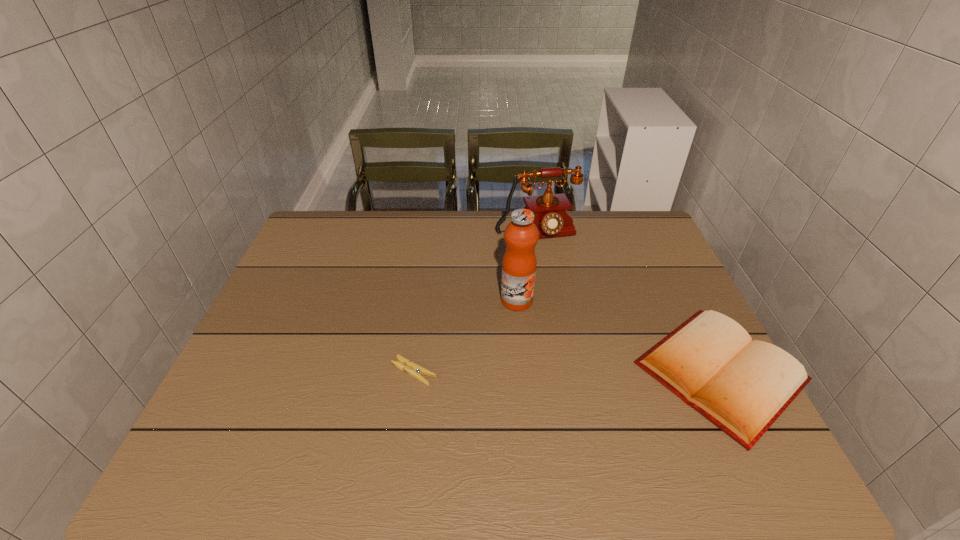
Where is `free space between the shortest object and the second farthest object`? free space between the shortest object and the second farthest object is located at coordinates (466, 336).

Identify the location of free spot between the third tallest object and the second farthest object. The height and width of the screenshot is (540, 960). (618, 336).

At what (x,y) coordinates should I click in order to perform the action: click on free space between the clothespin and the fruit juice. Please return your answer as a coordinate pair (x, y). This screenshot has width=960, height=540. Looking at the image, I should click on (466, 336).

At what (x,y) coordinates should I click in order to perform the action: click on empty space that is in between the clothespin and the fruit juice. Please return your answer as a coordinate pair (x, y). This screenshot has height=540, width=960. Looking at the image, I should click on (466, 336).

Locate an element on the screen. the third closest object to the second farthest object is located at coordinates (411, 368).

Locate which object ranks third in proximity to the shortest object. Please provide its 2D coordinates. Your answer should be formatted as a tuple, i.e. [(x, y)], where the tuple contains the x and y coordinates of a point satisfying the conditions above.

[(552, 219)]

Identify the location of free space that satisfies the following two spatial constraints: 1. on the back side of the third nearest object; 2. on the left side of the third shortest object. (511, 233).

I want to click on vacant space that satisfies the following two spatial constraints: 1. on the back side of the second farthest object; 2. on the right side of the second tallest object, so (511, 233).

At what (x,y) coordinates should I click in order to perform the action: click on free point that satisfies the following two spatial constraints: 1. on the front side of the Bible; 2. on the right side of the third shortest object. Please return your answer as a coordinate pair (x, y). The height and width of the screenshot is (540, 960). Looking at the image, I should click on (559, 372).

Locate an element on the screen. This screenshot has width=960, height=540. vacant area in the image that satisfies the following two spatial constraints: 1. on the back side of the telephone; 2. on the right side of the second farthest object is located at coordinates (511, 233).